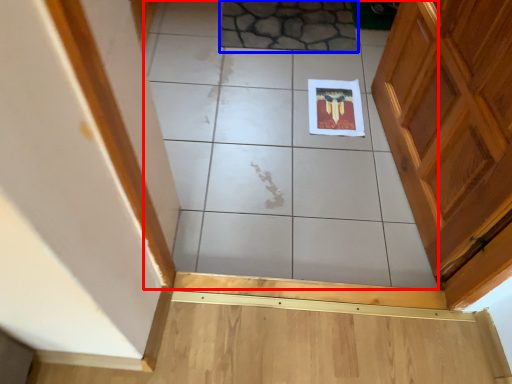
Question: Among these objects, which one is farthest to the camera, ceramic tile (highlighted by a red box) or ceramic tile (highlighted by a blue box)?

Choices:
 (A) ceramic tile
 (B) ceramic tile

Answer: (B)